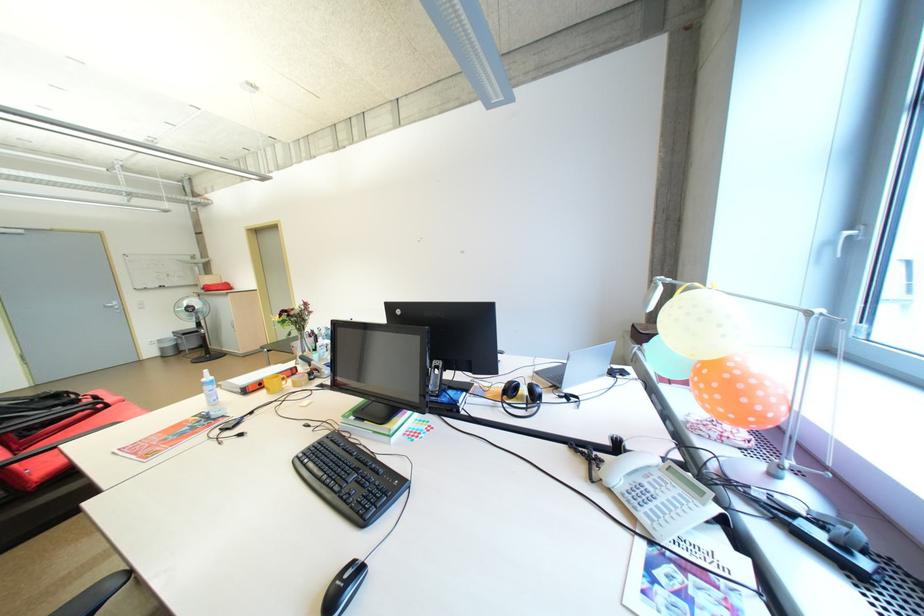
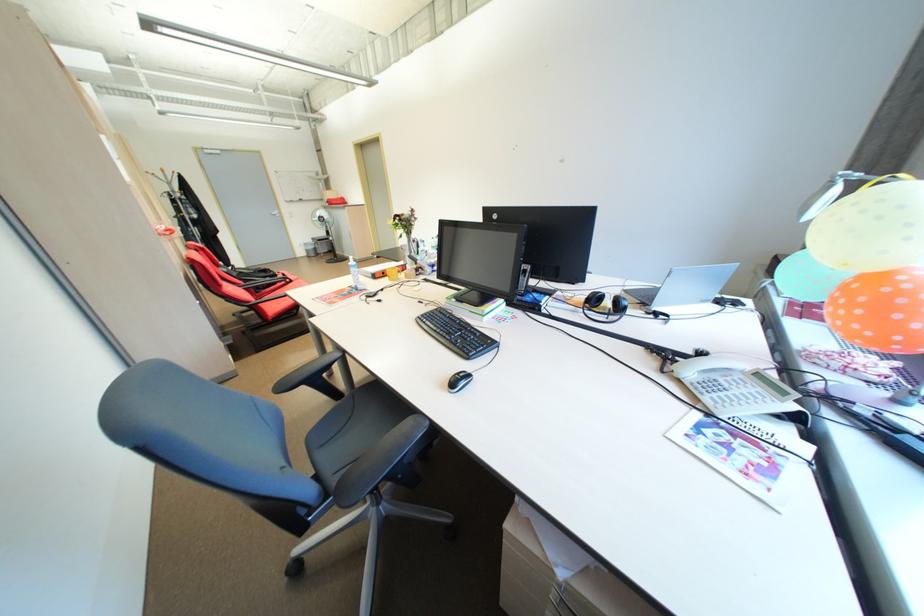
The point at (171, 350) is marked in the first image. Where is the corresponding point in the second image?

(315, 252)